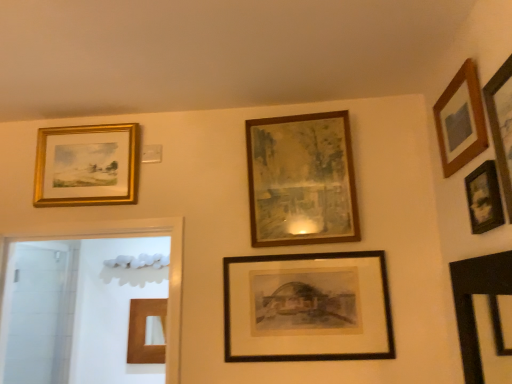
Question: Can we say wooden picture frame at upper right, placed as the first picture frame when sorted from right to left, lies outside wooden picture frame at upper right, acting as the fourth picture frame starting from the left?

Choices:
 (A) yes
 (B) no

Answer: (A)

Question: Is wooden picture frame at upper right, placed as the first picture frame when sorted from right to left, to the left of wooden picture frame at upper right, positioned as the 3th picture frame in right-to-left order, from the viewer's perspective?

Choices:
 (A) yes
 (B) no

Answer: (B)

Question: From a real-world perspective, is wooden picture frame at upper right, which is the 6th picture frame in left-to-right order, on wooden picture frame at upper right, positioned as the 3th picture frame in right-to-left order?

Choices:
 (A) yes
 (B) no

Answer: (A)

Question: From a real-world perspective, is wooden picture frame at upper right, which is the 6th picture frame in left-to-right order, positioned under wooden picture frame at upper right, positioned as the 3th picture frame in right-to-left order, based on gravity?

Choices:
 (A) yes
 (B) no

Answer: (B)

Question: Is wooden picture frame at upper right, which is the 6th picture frame in left-to-right order, aimed at wooden picture frame at upper right, positioned as the 3th picture frame in right-to-left order?

Choices:
 (A) no
 (B) yes

Answer: (A)

Question: Relative to black matte picture frame at center, which appears as the 3th picture frame when viewed from the left, is gold/gilded picture frame at upper left, which is counted as the sixth picture frame, starting from the right, in front or behind?

Choices:
 (A) front
 (B) behind

Answer: (B)

Question: In terms of size, does gold/gilded picture frame at upper left, which is counted as the sixth picture frame, starting from the right, appear bigger or smaller than black matte picture frame at center, which appears as the fourth picture frame when viewed from the right?

Choices:
 (A) big
 (B) small

Answer: (A)

Question: Does point (118, 203) appear closer or farther from the camera than point (377, 276)?

Choices:
 (A) closer
 (B) farther

Answer: (B)

Question: From a real-world perspective, relative to black matte picture frame at center, which appears as the 3th picture frame when viewed from the left, is gold/gilded picture frame at upper left, which is counted as the sixth picture frame, starting from the right, vertically above or below?

Choices:
 (A) below
 (B) above

Answer: (B)

Question: Considering the positions of wooden picture frame at upper right, positioned as the 3th picture frame in right-to-left order, and wooden picture frame at upper right, which is the 6th picture frame in left-to-right order, in the image, is wooden picture frame at upper right, positioned as the 3th picture frame in right-to-left order, taller or shorter than wooden picture frame at upper right, which is the 6th picture frame in left-to-right order,?

Choices:
 (A) short
 (B) tall

Answer: (B)

Question: Is wooden picture frame at upper right, acting as the fourth picture frame starting from the left, wider or thinner than wooden picture frame at upper right, placed as the first picture frame when sorted from right to left?

Choices:
 (A) wide
 (B) thin

Answer: (B)

Question: Based on their sizes in the image, would you say wooden picture frame at upper right, positioned as the 3th picture frame in right-to-left order, is bigger or smaller than wooden picture frame at upper right, placed as the first picture frame when sorted from right to left?

Choices:
 (A) big
 (B) small

Answer: (A)

Question: From the image's perspective, relative to wooden picture frame at upper right, which is the 6th picture frame in left-to-right order, is wooden picture frame at upper right, positioned as the 3th picture frame in right-to-left order, above or below?

Choices:
 (A) above
 (B) below

Answer: (B)

Question: From their relative heights in the image, would you say black matte picture frame at center, which appears as the fourth picture frame when viewed from the right, is taller or shorter than gold/gilded picture frame at upper left, which is counted as the sixth picture frame, starting from the right?

Choices:
 (A) short
 (B) tall

Answer: (B)

Question: Does point (354, 291) appear closer or farther from the camera than point (73, 200)?

Choices:
 (A) farther
 (B) closer

Answer: (B)